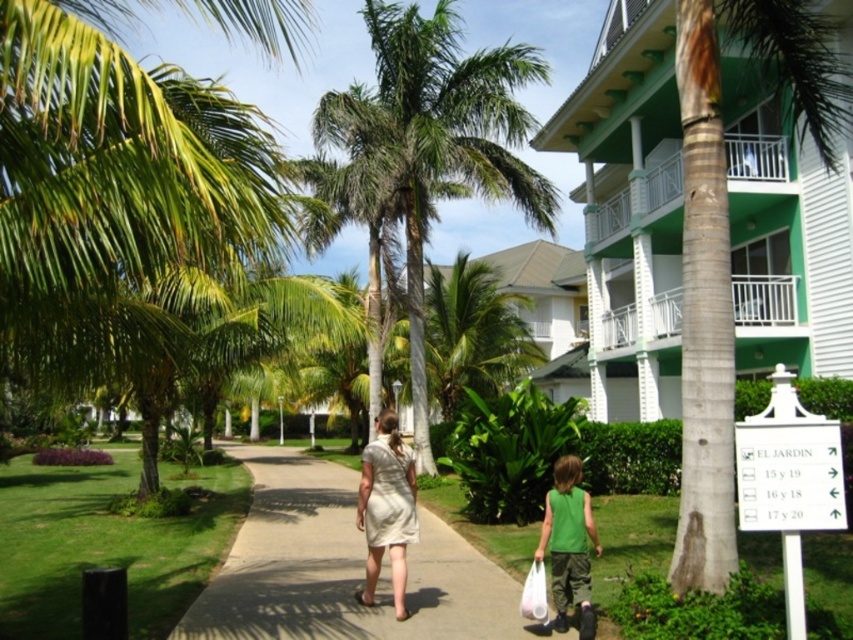
Can you confirm if light beige dress at center is smaller than green matte shirt at lower right?

Indeed, light beige dress at center has a smaller size compared to green matte shirt at lower right.

Is point (369, 600) less distant than point (567, 518)?

No, (369, 600) is further to viewer.

Which is in front, point (364, 595) or point (590, 637)?

Positioned in front is point (590, 637).

Find the location of a particular element. light beige dress at center is located at coordinates (386, 508).

Between green painted wood balcony at upper right and green leafy palm tree at center, which one is positioned lower?

green leafy palm tree at center is lower down.

Which of these two, green painted wood balcony at upper right or green leafy palm tree at center, stands shorter?

green leafy palm tree at center is shorter.

Is point (668, 264) positioned before point (515, 166)?

No, (668, 264) is further to viewer.

What are the coordinates of `green painted wood balcony at upper right` in the screenshot? It's located at (630, 209).

Is green leafy palm tree at center to the left of green grass at center from the viewer's perspective?

No, green leafy palm tree at center is not to the left of green grass at center.

Does green leafy palm tree at center have a lesser width compared to green grass at center?

No, green leafy palm tree at center is not thinner than green grass at center.

Image resolution: width=853 pixels, height=640 pixels. What do you see at coordinates (425, 147) in the screenshot? I see `green leafy palm tree at center` at bounding box center [425, 147].

Identify the location of green leafy palm tree at center. Image resolution: width=853 pixels, height=640 pixels. (425, 147).